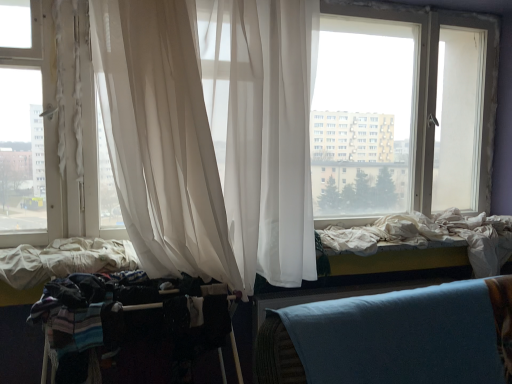
Question: Would you say sheer white curtain at center is inside or outside dark fabric baby carriage at lower left?

Choices:
 (A) inside
 (B) outside

Answer: (B)

Question: From a real-world perspective, is sheer white curtain at center physically located above or below dark fabric baby carriage at lower left?

Choices:
 (A) above
 (B) below

Answer: (A)

Question: Is point (314, 51) positioned closer to the camera than point (90, 279)?

Choices:
 (A) closer
 (B) farther

Answer: (B)

Question: From a real-world perspective, is dark fabric baby carriage at lower left positioned above or below sheer white curtain at center?

Choices:
 (A) above
 (B) below

Answer: (B)

Question: From the image's perspective, is dark fabric baby carriage at lower left located above or below sheer white curtain at center?

Choices:
 (A) above
 (B) below

Answer: (B)

Question: Is dark fabric baby carriage at lower left bigger or smaller than sheer white curtain at center?

Choices:
 (A) small
 (B) big

Answer: (A)

Question: In terms of width, does dark fabric baby carriage at lower left look wider or thinner when compared to sheer white curtain at center?

Choices:
 (A) thin
 (B) wide

Answer: (A)